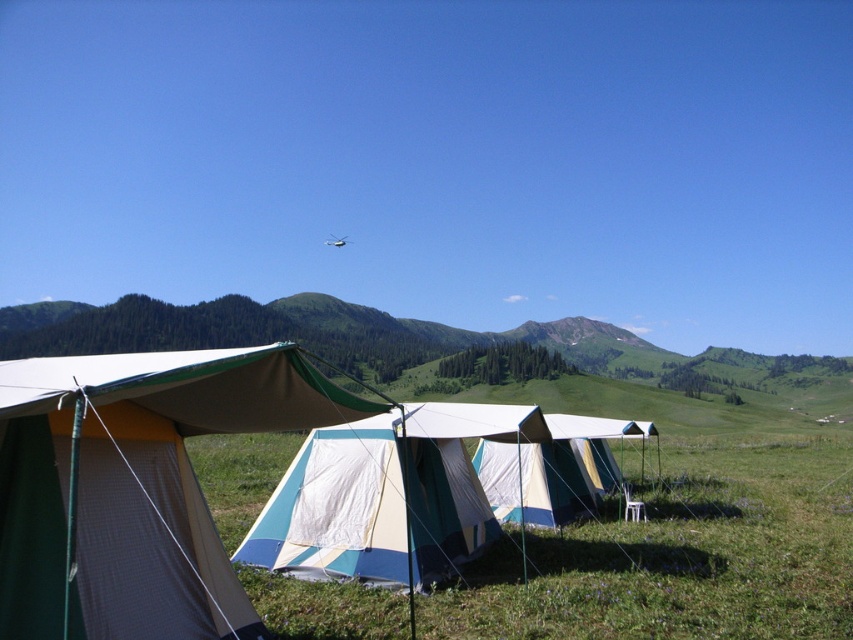
You are standing at the point marked by coordinates point (135,486) in the image. Looking around, you see a matte canvas tent at left. Which direction should you face to see the tents arranged in a row?

You should face towards the tents arranged in a row direction, which is to your right since the matte canvas tent at left is located to your left side.

You are a camper who wants to set up a 12 feet long tent between the matte canvas tent at left and the white canvas tent at center. Is there enough space between them?

The distance between the matte canvas tent at left and the white canvas tent at center is 14.61 feet, so yes, there is enough space to set up a 12 feet long tent between them.